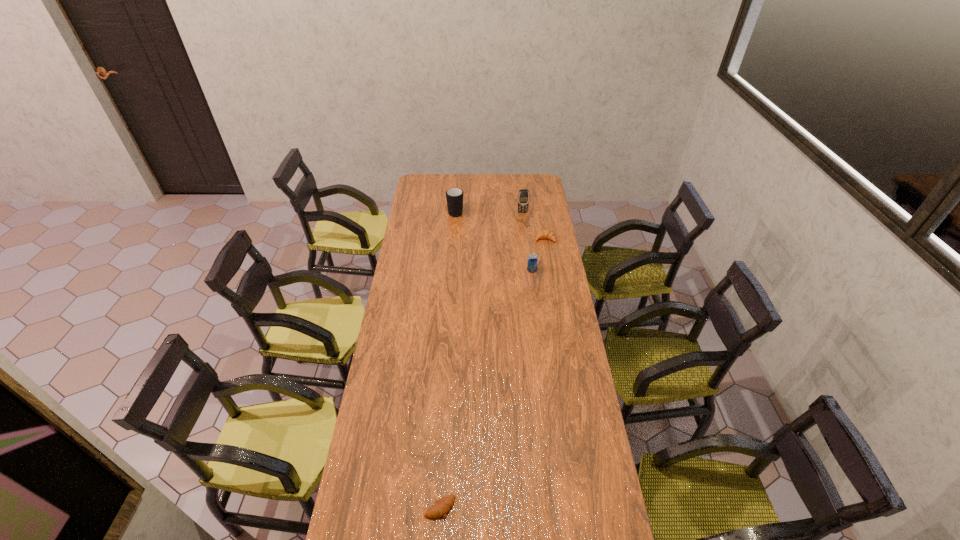
This screenshot has height=540, width=960. I want to click on object that is the fourth closest to the cellular telephone, so click(x=440, y=507).

Identify which crescent roll is the second nearest to the cellular telephone. Please provide its 2D coordinates. Your answer should be formatted as a tuple, i.e. [(x, y)], where the tuple contains the x and y coordinates of a point satisfying the conditions above.

[(440, 507)]

Point out which crescent roll is positioned as the second nearest to the cellular telephone. Please provide its 2D coordinates. Your answer should be formatted as a tuple, i.e. [(x, y)], where the tuple contains the x and y coordinates of a point satisfying the conditions above.

[(440, 507)]

This screenshot has width=960, height=540. In order to click on free region that satisfies the following two spatial constraints: 1. on the front face of the cellular telephone; 2. on the left side of the right crescent roll in this screenshot , I will do `click(526, 239)`.

At what (x,y) coordinates should I click in order to perform the action: click on free space that satisfies the following two spatial constraints: 1. on the back side of the fourth tallest object; 2. on the left side of the shortest object. Please return your answer as a coordinate pair (x, y). Image resolution: width=960 pixels, height=540 pixels. Looking at the image, I should click on (457, 239).